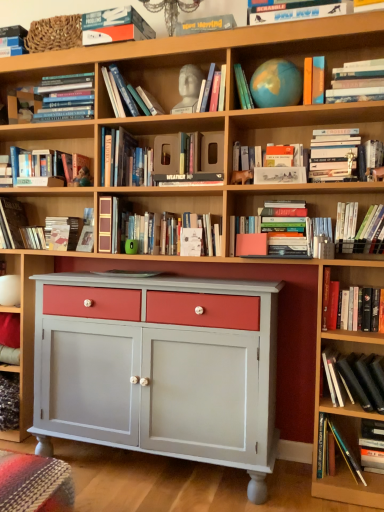
The image size is (384, 512). Find the location of `free space above hardcover book at upper right, positioned as the 10th book in top-to-bottom order (from a real-world perspective)`. free space above hardcover book at upper right, positioned as the 10th book in top-to-bottom order (from a real-world perspective) is located at coordinates (344, 122).